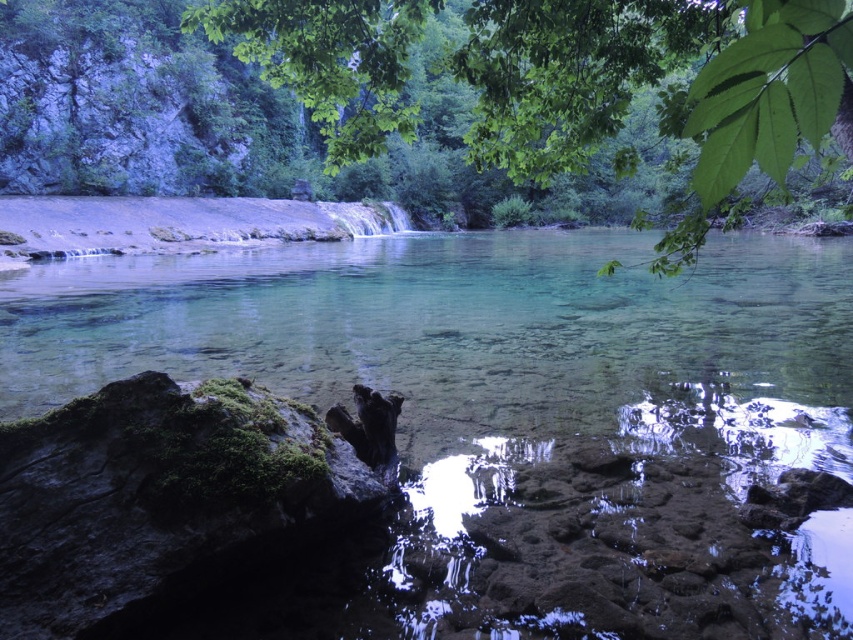
Question: Can you confirm if clear glassy water at center is positioned to the left of green leafy tree at upper center?

Choices:
 (A) yes
 (B) no

Answer: (B)

Question: Which of the following is the farthest from the observer?

Choices:
 (A) (253, 324)
 (B) (361, 108)

Answer: (A)

Question: Is clear glassy water at center above green leafy tree at upper center?

Choices:
 (A) no
 (B) yes

Answer: (A)

Question: Which point is farther to the camera?

Choices:
 (A) green leafy tree at upper center
 (B) clear glassy water at center

Answer: (B)

Question: Is clear glassy water at center to the left of green leafy tree at upper center from the viewer's perspective?

Choices:
 (A) no
 (B) yes

Answer: (A)